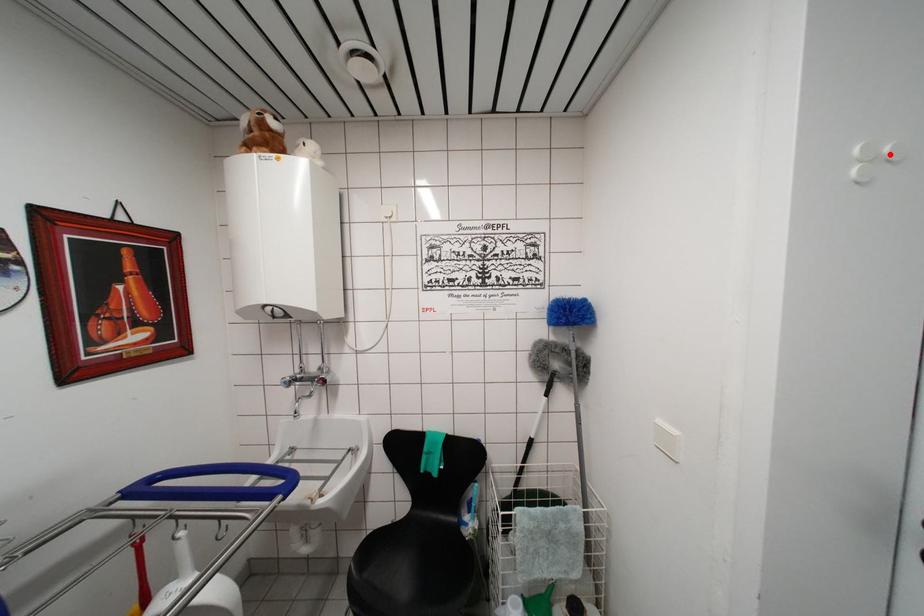
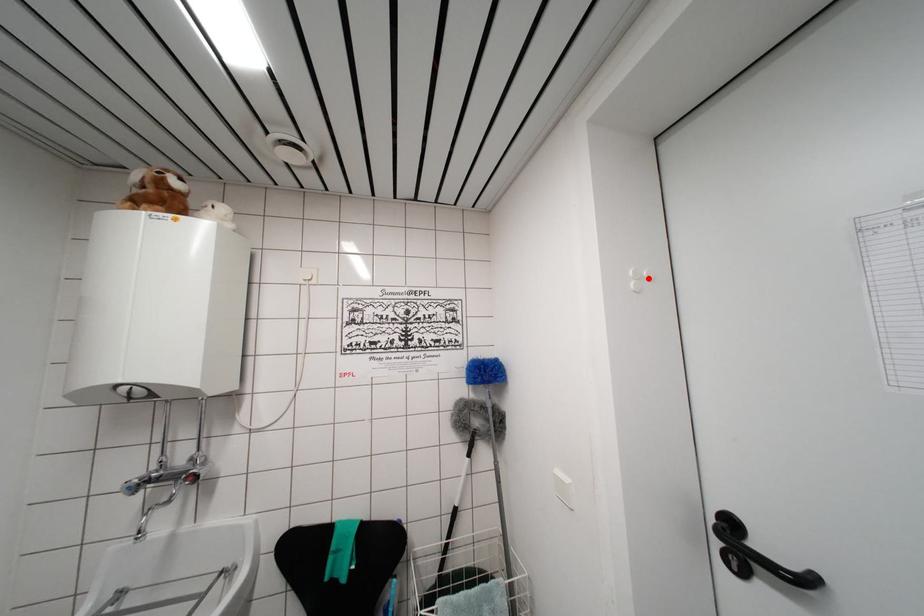
I am providing you with two images of the same scene from different viewpoints. A red point is marked on the first image and another point is marked on the second image. Are the points marked in image1 and image2 representing the same 3D position?

Yes